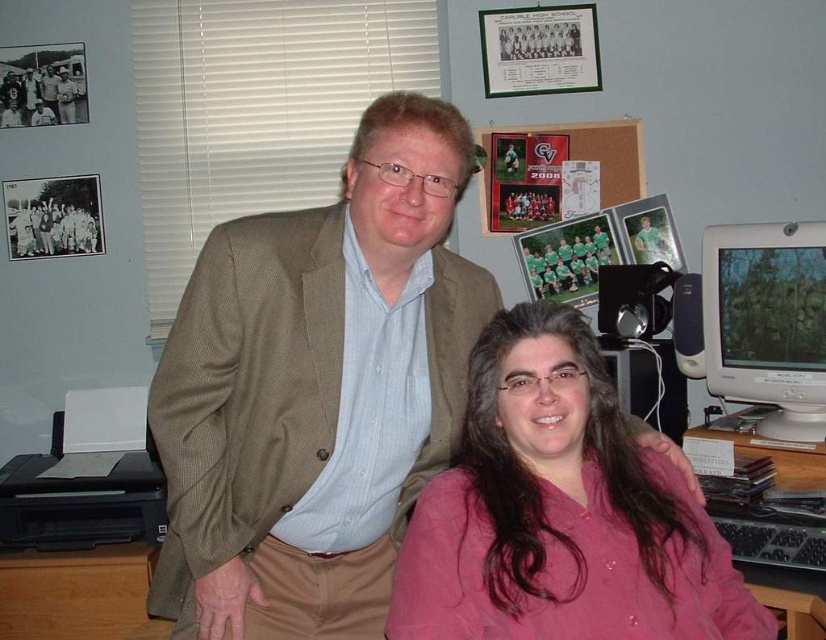
Is pink matte shirt at center bigger than brown wooden table at lower left?

Yes.

Is the position of pink matte shirt at center more distant than that of brown wooden table at lower left?

No, pink matte shirt at center is in front of brown wooden table at lower left.

Identify the location of pink matte shirt at center. The image size is (826, 640). (559, 512).

Which is more to the right, matte white monitor at right or wooden at right?

matte white monitor at right is more to the right.

Does matte white monitor at right appear on the left side of wooden at right?

Incorrect, matte white monitor at right is not on the left side of wooden at right.

Between point (810, 228) and point (814, 480), which one is positioned in front?

Point (814, 480)

This screenshot has width=826, height=640. Identify the location of matte white monitor at right. (767, 323).

Does point (537, 365) come behind point (784, 612)?

No, it is in front of (784, 612).

Which is more to the left, pink matte shirt at center or wooden at right?

pink matte shirt at center

Does point (487, 422) come farther from viewer compared to point (819, 637)?

That is False.

Identify the location of pink matte shirt at center. Image resolution: width=826 pixels, height=640 pixels. (559, 512).